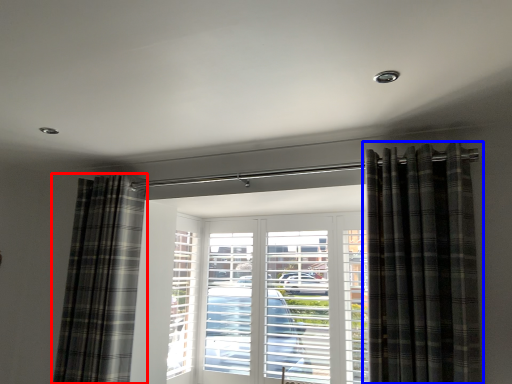
Question: Which object is closer to the camera taking this photo, curtain (highlighted by a red box) or curtain (highlighted by a blue box)?

Choices:
 (A) curtain
 (B) curtain

Answer: (B)